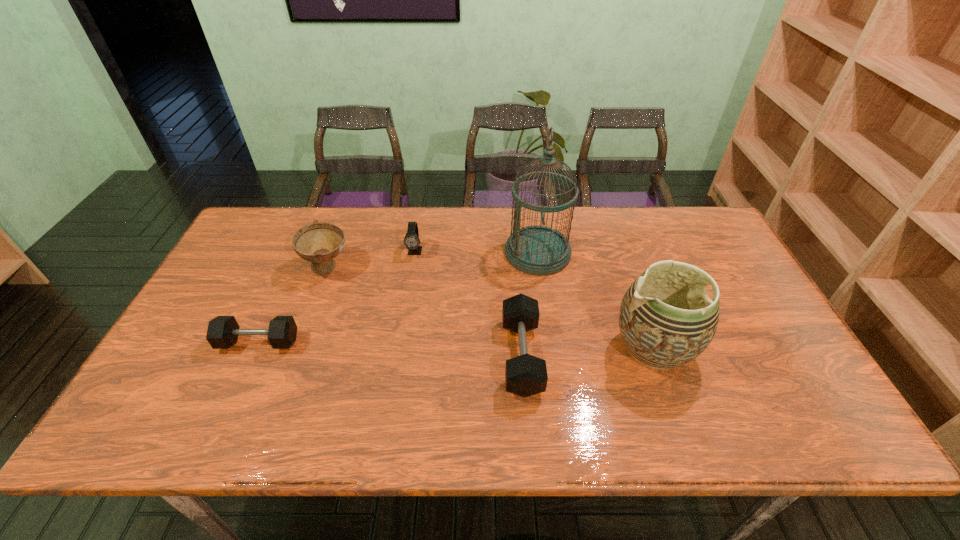
Locate an element on the screen. The width and height of the screenshot is (960, 540). object that is positioned at the left edge is located at coordinates (222, 333).

Image resolution: width=960 pixels, height=540 pixels. Identify the location of free space at the far edge of the desktop. click(x=453, y=229).

Image resolution: width=960 pixels, height=540 pixels. In the image, there is a desktop. Find the location of `vacant area at the near edge`. vacant area at the near edge is located at coordinates pyautogui.click(x=503, y=393).

Locate an element on the screen. vacant area at the left edge is located at coordinates (186, 330).

Locate an element on the screen. This screenshot has height=540, width=960. free space at the right edge of the desktop is located at coordinates (749, 285).

Locate an element on the screen. vacant space at the far left corner of the desktop is located at coordinates (257, 239).

The height and width of the screenshot is (540, 960). I want to click on vacant area at the near right corner of the desktop, so click(772, 396).

The image size is (960, 540). I want to click on free space between the rightmost object and the soup bowl, so click(x=491, y=308).

Where is `vacant region between the second tallest object and the left dumbbell`? vacant region between the second tallest object and the left dumbbell is located at coordinates (456, 346).

Locate an element on the screen. vacant area between the rightmost object and the taller dumbbell is located at coordinates (588, 352).